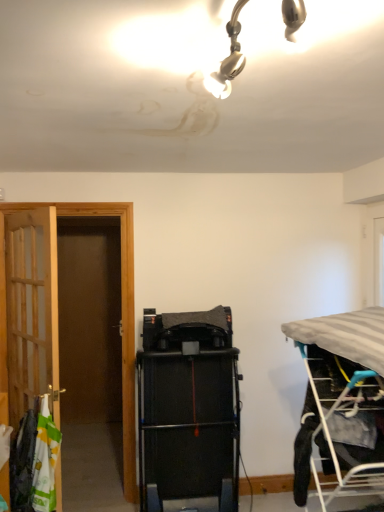
Question: From the image's perspective, is black rubber treadmill at center over wooden door at left?

Choices:
 (A) yes
 (B) no

Answer: (B)

Question: From the image's perspective, is black rubber treadmill at center under wooden door at left?

Choices:
 (A) no
 (B) yes

Answer: (B)

Question: Considering the relative positions of black rubber treadmill at center and wooden door at left in the image provided, is black rubber treadmill at center to the right of wooden door at left from the viewer's perspective?

Choices:
 (A) no
 (B) yes

Answer: (B)

Question: Is black rubber treadmill at center to the left of wooden door at left from the viewer's perspective?

Choices:
 (A) yes
 (B) no

Answer: (B)

Question: From a real-world perspective, is black rubber treadmill at center below wooden door at left?

Choices:
 (A) no
 (B) yes

Answer: (B)

Question: Would you say black rubber treadmill at center is to the left or to the right of white fabric laundry at left in the picture?

Choices:
 (A) right
 (B) left

Answer: (A)

Question: Looking at their shapes, would you say black rubber treadmill at center is wider or thinner than white fabric laundry at left?

Choices:
 (A) thin
 (B) wide

Answer: (B)

Question: From a real-world perspective, is black rubber treadmill at center above or below white fabric laundry at left?

Choices:
 (A) above
 (B) below

Answer: (A)

Question: Considering their positions, is black rubber treadmill at center located in front of or behind white fabric laundry at left?

Choices:
 (A) behind
 (B) front

Answer: (A)

Question: Visually, is wooden door at left positioned to the left or to the right of gray fabric bed at right?

Choices:
 (A) left
 (B) right

Answer: (A)

Question: Is wooden door at left in front of or behind gray fabric bed at right in the image?

Choices:
 (A) front
 (B) behind

Answer: (B)

Question: Is wooden door at left situated inside gray fabric bed at right or outside?

Choices:
 (A) inside
 (B) outside

Answer: (B)

Question: In terms of width, does wooden door at left look wider or thinner when compared to gray fabric bed at right?

Choices:
 (A) thin
 (B) wide

Answer: (A)

Question: In terms of size, does white fabric laundry at left appear bigger or smaller than black rubber treadmill at center?

Choices:
 (A) big
 (B) small

Answer: (B)

Question: From a real-world perspective, is white fabric laundry at left above or below black rubber treadmill at center?

Choices:
 (A) below
 (B) above

Answer: (A)